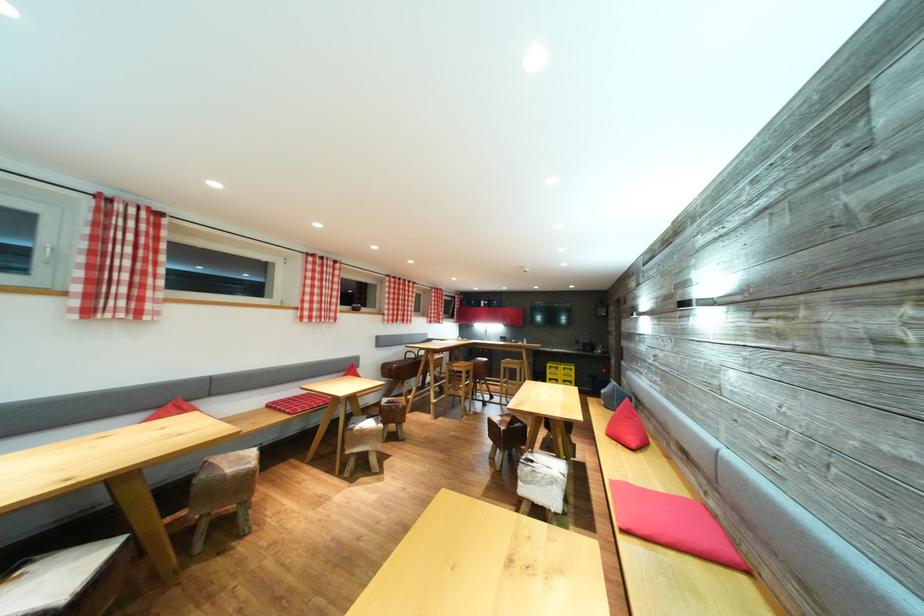
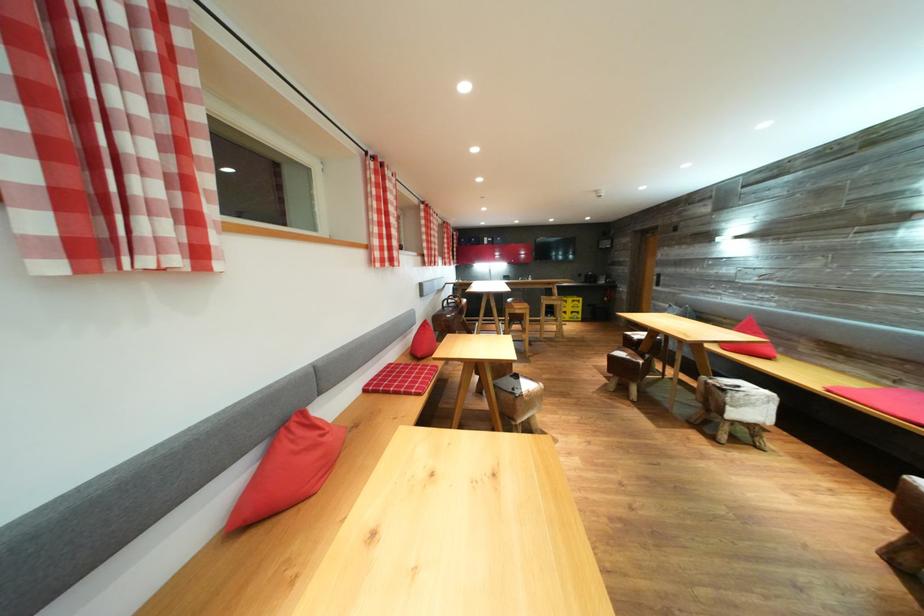
In the second image, find the point that corresponds to the point at 540,467 in the first image.

(745, 392)